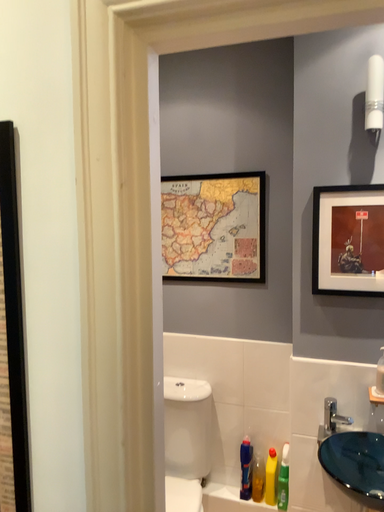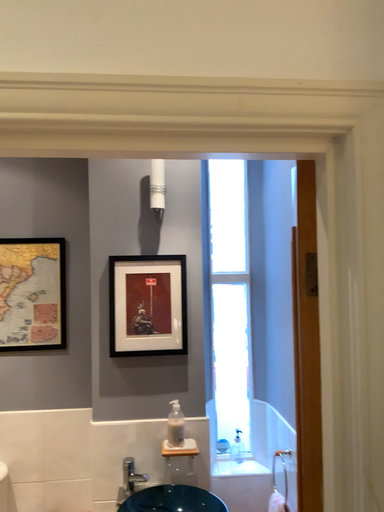
Question: Which way did the camera rotate in the video?

Choices:
 (A) rotated left
 (B) rotated right

Answer: (B)